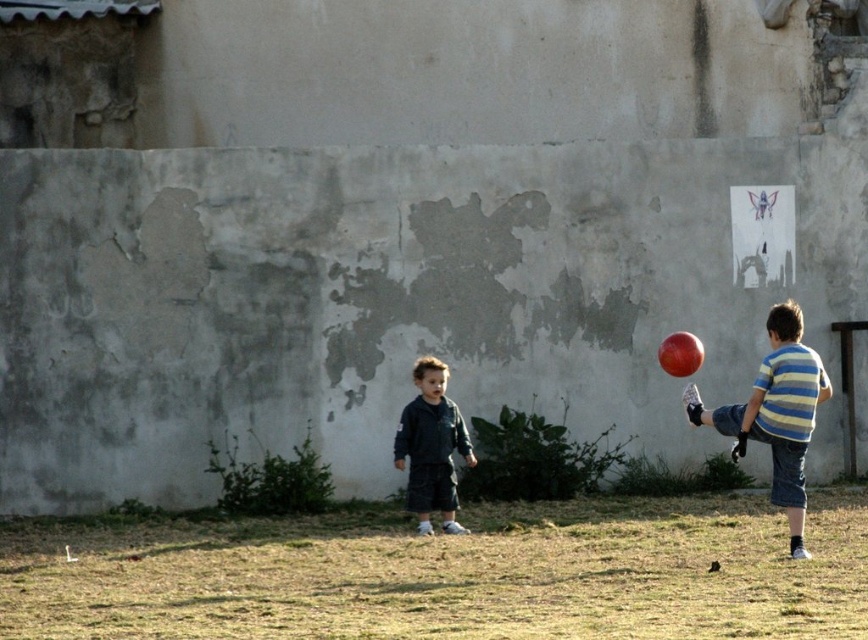
You are a photographer trying to capture a shot of the two children playing near the weathered wall. You want to ensure both the striped cotton shirt at right and the dark blue denim jacket at center are visible in your frame. Based on their positions, which clothing item is located more to the right side of the image?

The striped cotton shirt at right is positioned on the right side of the dark blue denim jacket at center, so the striped cotton shirt at right is more to the right in the image.

You are a photographer trying to capture both the striped cotton shirt at right and the dark blue denim jacket at center in a single shot. Based on their positions, which object is closer to the camera?

The striped cotton shirt at right is closer to the camera because it is in front of the dark blue denim jacket at center.